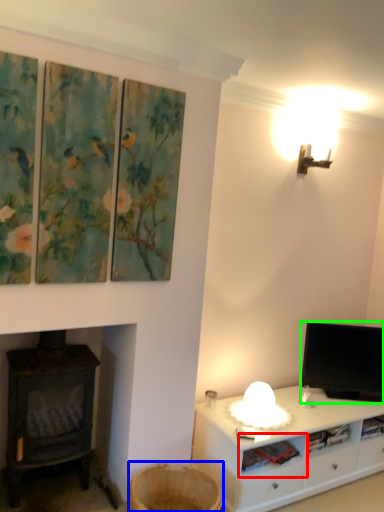
Question: Based on their relative distances, which object is nearer to shelf (highlighted by a red box)? Choose from basket (highlighted by a blue box) and television (highlighted by a green box).

Choices:
 (A) basket
 (B) television

Answer: (A)